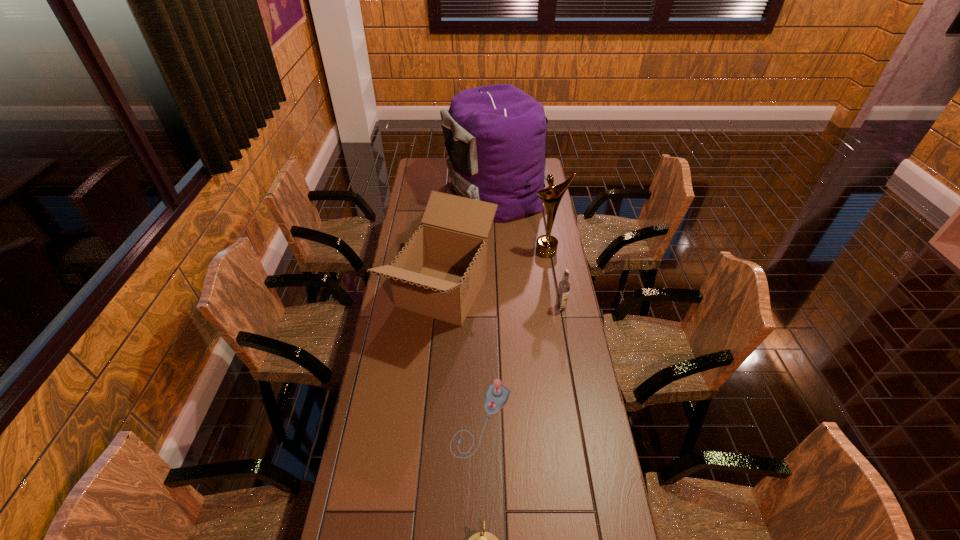
Locate an element on the screen. This screenshot has width=960, height=540. backpack is located at coordinates coord(495,135).

This screenshot has width=960, height=540. What are the coordinates of `the tallest object` in the screenshot? It's located at (495, 135).

Find the location of `the fifth shortest object`. the fifth shortest object is located at coordinates (546, 246).

Locate an element on the screen. The image size is (960, 540). box is located at coordinates (439, 272).

The width and height of the screenshot is (960, 540). Find the location of `the third shortest object`. the third shortest object is located at coordinates (564, 286).

You are a GUI agent. You are given a task and a screenshot of the screen. Output one action in this format:
    pyautogui.click(x=<x>, y=<y>)
    Task: Click on the shortest object
    
    Given the screenshot: What is the action you would take?
    pyautogui.click(x=496, y=396)

At what (x,y) coordinates should I click in order to perform the action: click on the fifth farthest object. Please return your answer as a coordinate pair (x, y). This screenshot has height=540, width=960. Looking at the image, I should click on (x=496, y=396).

I want to click on vacant space located 0.050m on the front pocket of the backpack, so click(x=434, y=192).

What are the coordinates of `free region located 0.050m on the front pocket of the backpack` in the screenshot? It's located at (434, 192).

This screenshot has width=960, height=540. What are the coordinates of `vacant area situated on the front pocket of the backpack` in the screenshot? It's located at (420, 192).